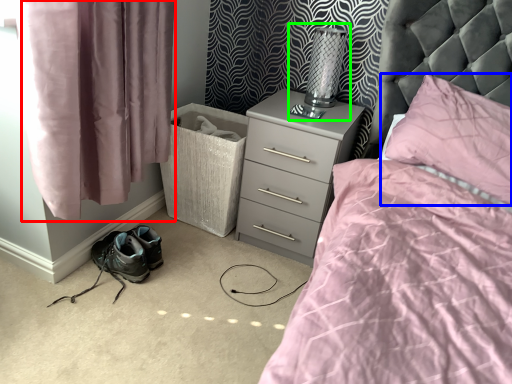
Question: Considering the real-world distances, which object is farthest from curtain (highlighted by a red box)? pillow (highlighted by a blue box) or table lamp (highlighted by a green box)?

Choices:
 (A) pillow
 (B) table lamp

Answer: (A)